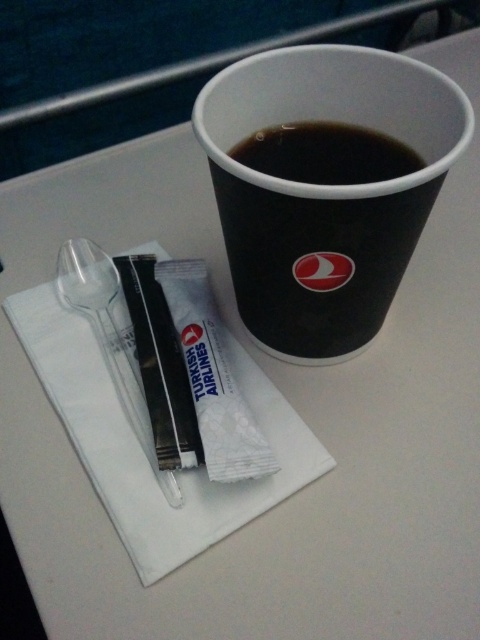
You are a flight attendant checking the meal tray. You need to hand the black matte cup at upper center to a passenger. To make it easier to reach, should you move the transparent plastic spoon at left upwards or downwards?

The transparent plastic spoon at left is located below the black matte cup at upper center. To make it easier to reach the cup, you should move the transparent plastic spoon at left upwards so it is no longer blocking the space beneath the cup.

You are a flight attendant checking the meal tray. You need to pour hot water into the larger cup. Which one should you choose between the black paper cup at upper center and the black matte cup at upper center?

The black paper cup at upper center is larger than the black matte cup at upper center, so you should choose the black paper cup at upper center to pour hot water into.